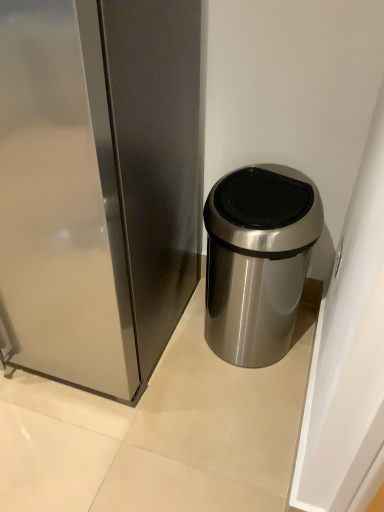
Question: Considering the relative positions of satin silver trash can at center and satin silver trash can at right in the image provided, is satin silver trash can at center behind satin silver trash can at right?

Choices:
 (A) no
 (B) yes

Answer: (B)

Question: Is satin silver trash can at center bigger than satin silver trash can at right?

Choices:
 (A) yes
 (B) no

Answer: (B)

Question: Does satin silver trash can at center have a greater width compared to satin silver trash can at right?

Choices:
 (A) yes
 (B) no

Answer: (B)

Question: Is satin silver trash can at right a part of satin silver trash can at center?

Choices:
 (A) no
 (B) yes

Answer: (A)

Question: Is satin silver trash can at center positioned far away from satin silver trash can at right?

Choices:
 (A) no
 (B) yes

Answer: (A)

Question: Is satin silver trash can at center outside satin silver trash can at right?

Choices:
 (A) yes
 (B) no

Answer: (A)

Question: Considering the relative positions of satin silver trash can at right and satin silver trash can at center in the image provided, is satin silver trash can at right to the right of satin silver trash can at center from the viewer's perspective?

Choices:
 (A) no
 (B) yes

Answer: (A)

Question: From a real-world perspective, is satin silver trash can at right positioned over satin silver trash can at center based on gravity?

Choices:
 (A) yes
 (B) no

Answer: (A)

Question: From a real-world perspective, is satin silver trash can at right under satin silver trash can at center?

Choices:
 (A) no
 (B) yes

Answer: (A)

Question: Considering the relative sizes of satin silver trash can at right and satin silver trash can at center in the image provided, is satin silver trash can at right bigger than satin silver trash can at center?

Choices:
 (A) yes
 (B) no

Answer: (A)

Question: From the image's perspective, is satin silver trash can at right located above satin silver trash can at center?

Choices:
 (A) yes
 (B) no

Answer: (A)

Question: From the image's perspective, does satin silver trash can at right appear lower than satin silver trash can at center?

Choices:
 (A) no
 (B) yes

Answer: (A)

Question: Looking at their shapes, would you say satin silver trash can at right is wider or thinner than satin silver trash can at center?

Choices:
 (A) thin
 (B) wide

Answer: (B)